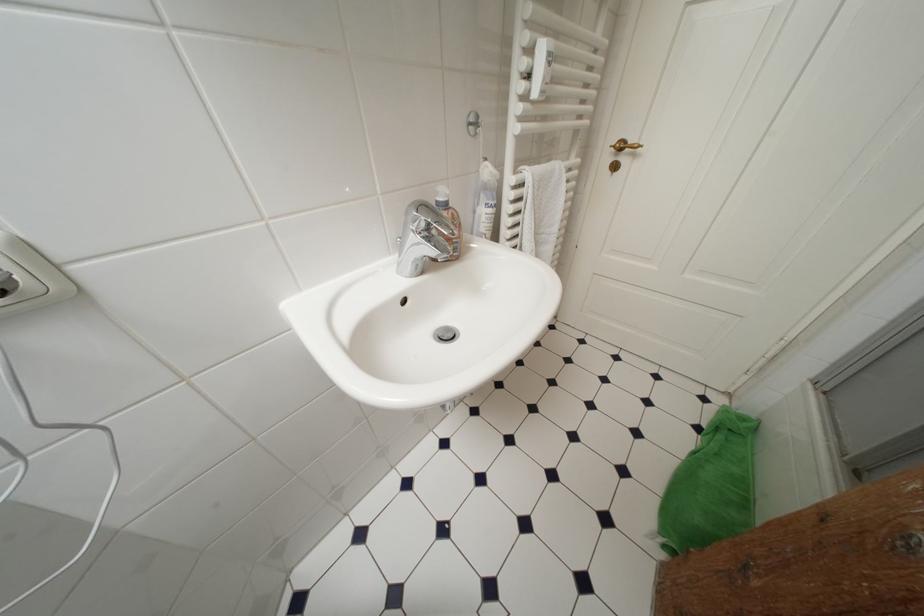
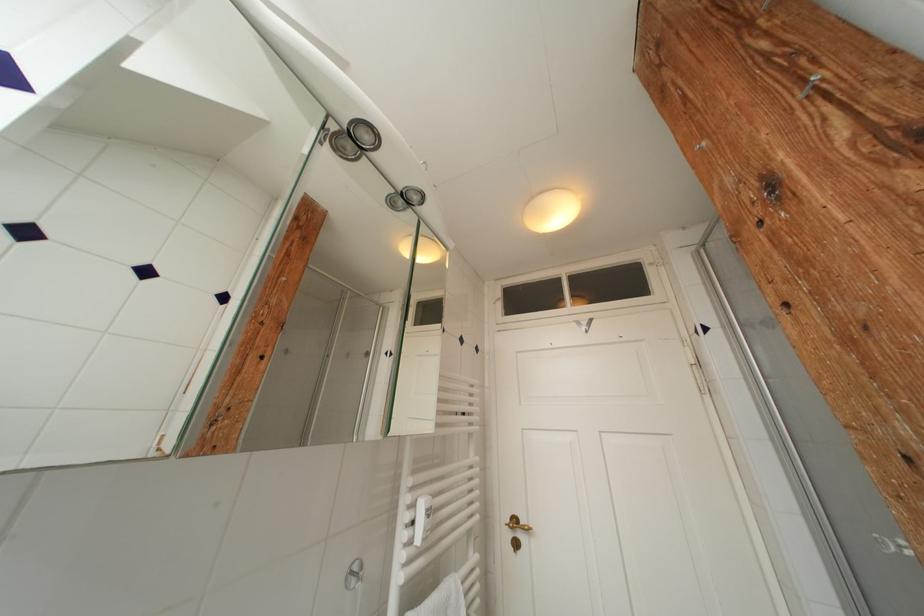
Locate, in the second image, the point that corresponds to (477,126) in the first image.

(358, 578)